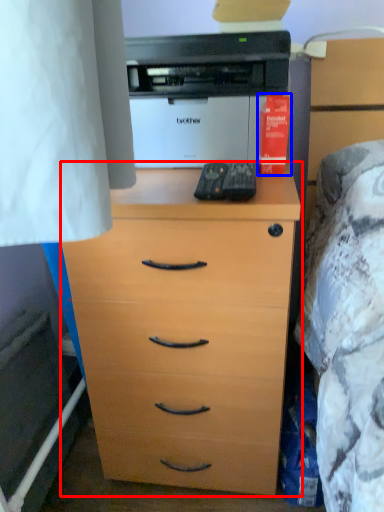
Question: Among these objects, which one is farthest to the camera, chest of drawers (highlighted by a red box) or book (highlighted by a blue box)?

Choices:
 (A) chest of drawers
 (B) book

Answer: (B)